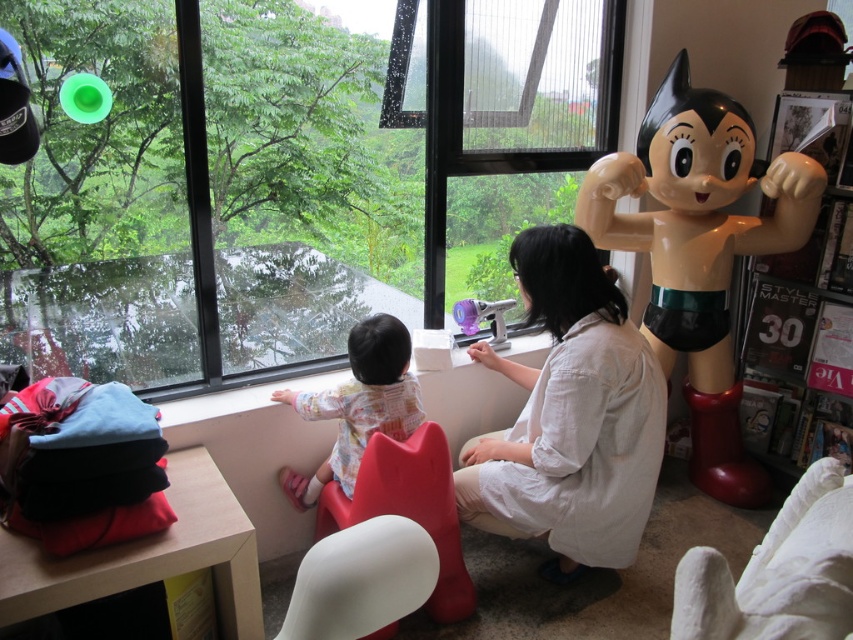
Can you confirm if fluffy pink plush at lower center is shorter than transparent plastic toy at center?

In fact, fluffy pink plush at lower center may be taller than transparent plastic toy at center.

Between fluffy pink plush at lower center and transparent plastic toy at center, which one is positioned lower?

fluffy pink plush at lower center

Locate an element on the screen. Image resolution: width=853 pixels, height=640 pixels. fluffy pink plush at lower center is located at coordinates (358, 404).

Does glossy plastic astro boy at right come in front of fluffy pink plush at lower center?

That is False.

Does glossy plastic astro boy at right have a greater height compared to fluffy pink plush at lower center?

Correct, glossy plastic astro boy at right is much taller as fluffy pink plush at lower center.

Which is in front, point (727, 266) or point (343, 442)?

Point (343, 442) is more forward.

At what (x,y) coordinates should I click in order to perform the action: click on glossy plastic astro boy at right. Please return your answer as a coordinate pair (x, y). Looking at the image, I should click on (700, 250).

Does transparent glass window at upper center appear over white plastic chair at lower center?

Yes, transparent glass window at upper center is above white plastic chair at lower center.

Who is more forward, (202, 83) or (309, 634)?

Point (309, 634)

Between point (131, 104) and point (364, 627), which one is positioned behind?

The point (131, 104) is more distant.

Image resolution: width=853 pixels, height=640 pixels. I want to click on transparent glass window at upper center, so click(283, 173).